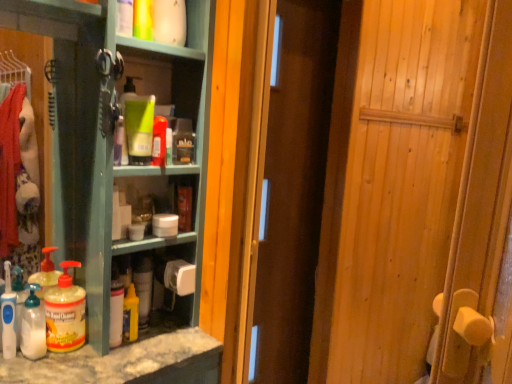
Question: From the image's perspective, is white matte bottle at lower center, acting as the 1th bottle starting from the right, located above or below wooden door at center, the 2th door positioned from the front?

Choices:
 (A) below
 (B) above

Answer: (A)

Question: Is point (112, 324) positioned closer to the camera than point (291, 349)?

Choices:
 (A) closer
 (B) farther

Answer: (A)

Question: Which object is the closest to the translucent plastic bottle at lower left, positioned as the first bottle in left-to-right order?

Choices:
 (A) translucent plastic pump bottle at lower left, which ranks as the 2th cleaning product in bottom-to-top order
 (B) yellow matte bottle at center, the second cleaning product when ordered from right to left
 (C) translucent plastic soap dispenser at lower left, the third cleaning product in the bottom-to-top sequence
 (D) white matte bottle at lower center, positioned as the 2th bottle in left-to-right order
 (E) wooden door at center, acting as the first door starting from the back

Answer: (A)

Question: Estimate the real-world distances between objects in this image. Which object is farther from the translucent plastic soap dispenser at lower left, which appears as the 4th cleaning product when viewed from the right?

Choices:
 (A) wooden door at center, the 2th door positioned from the front
 (B) white matte toilet paper at center
 (C) white matte bottle at lower center, acting as the 1th bottle starting from the right
 (D) translucent plastic pump bottle at lower left, acting as the third cleaning product starting from the right
 (E) yellow matte bottle at center, the first cleaning product ordered from the bottom

Answer: (A)